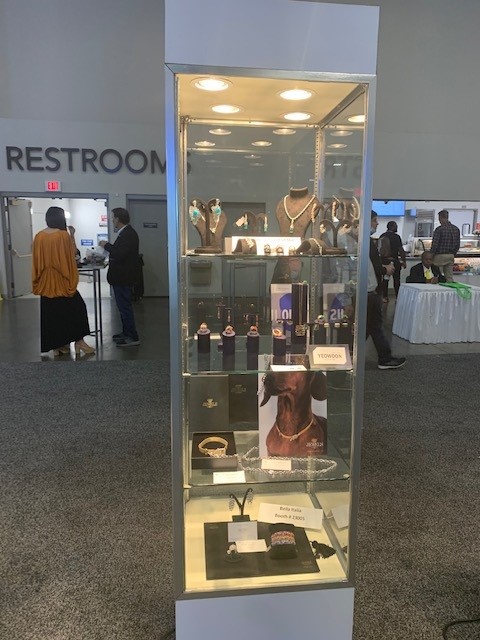
Image resolution: width=480 pixels, height=640 pixels. In order to click on cord in this screenshot , I will do `click(442, 628)`.